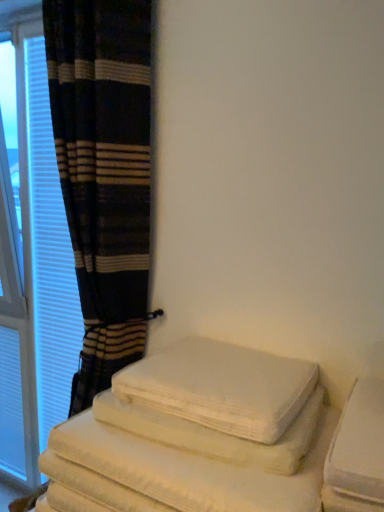
Question: Is white cotton bath towel at lower right oriented towards white textured curtain at left?

Choices:
 (A) yes
 (B) no

Answer: (B)

Question: Is white cotton bath towel at lower right closer to camera compared to white textured curtain at left?

Choices:
 (A) no
 (B) yes

Answer: (B)

Question: Considering the relative sizes of white cotton bath towel at lower right and white textured curtain at left in the image provided, is white cotton bath towel at lower right smaller than white textured curtain at left?

Choices:
 (A) no
 (B) yes

Answer: (B)

Question: Does white cotton bath towel at lower right have a greater height compared to white textured curtain at left?

Choices:
 (A) yes
 (B) no

Answer: (B)

Question: Can you confirm if white cotton bath towel at lower right is bigger than white textured curtain at left?

Choices:
 (A) no
 (B) yes

Answer: (A)

Question: From the image's perspective, would you say white cotton bath towel at lower right is shown under white textured curtain at left?

Choices:
 (A) yes
 (B) no

Answer: (A)

Question: From a real-world perspective, does plaid fabric curtain at left stand above white cotton bath towel at lower right?

Choices:
 (A) no
 (B) yes

Answer: (B)

Question: Does plaid fabric curtain at left have a larger size compared to white cotton bath towel at lower right?

Choices:
 (A) no
 (B) yes

Answer: (B)

Question: From the image's perspective, would you say plaid fabric curtain at left is positioned over white cotton bath towel at lower right?

Choices:
 (A) yes
 (B) no

Answer: (A)

Question: Is plaid fabric curtain at left located outside white cotton bath towel at lower right?

Choices:
 (A) yes
 (B) no

Answer: (A)

Question: Considering the relative sizes of plaid fabric curtain at left and white cotton bath towel at lower right in the image provided, is plaid fabric curtain at left taller than white cotton bath towel at lower right?

Choices:
 (A) yes
 (B) no

Answer: (A)

Question: From the image's perspective, is plaid fabric curtain at left below white cotton bath towel at lower right?

Choices:
 (A) no
 (B) yes

Answer: (A)

Question: Is white cotton bath towel at lower right positioned before plaid fabric curtain at left?

Choices:
 (A) yes
 (B) no

Answer: (A)